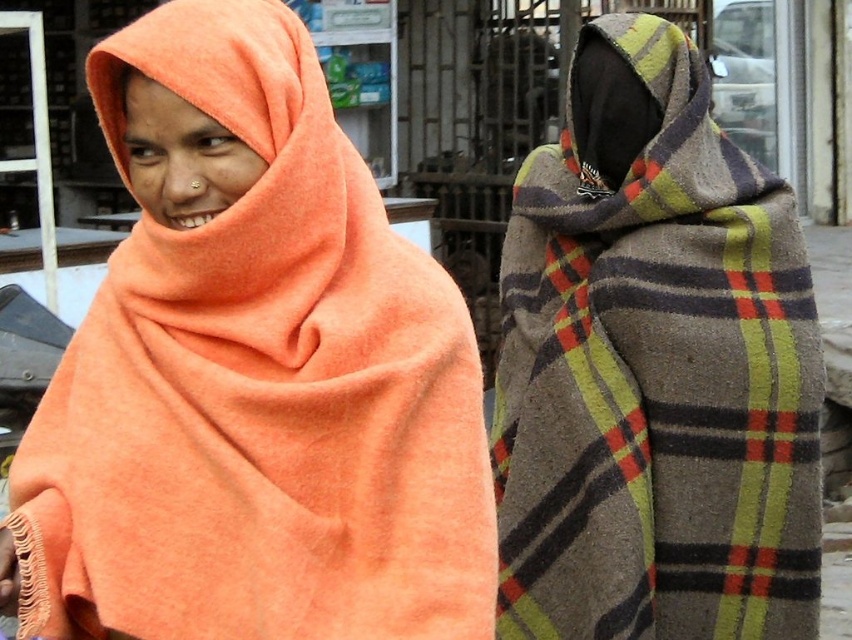
Question: Is matte orange shawl at left below plaid woolen scarf at right?

Choices:
 (A) yes
 (B) no

Answer: (B)

Question: Is matte orange shawl at left below plaid woolen scarf at right?

Choices:
 (A) yes
 (B) no

Answer: (B)

Question: Which of the following is the closest to the observer?

Choices:
 (A) (637, 112)
 (B) (199, 417)

Answer: (B)

Question: Which point is farther to the camera?

Choices:
 (A) (651, 227)
 (B) (168, 264)

Answer: (A)

Question: Can you confirm if matte orange shawl at left is smaller than plaid woolen scarf at right?

Choices:
 (A) no
 (B) yes

Answer: (B)

Question: Among these points, which one is farthest from the camera?

Choices:
 (A) (671, 118)
 (B) (203, 497)

Answer: (A)